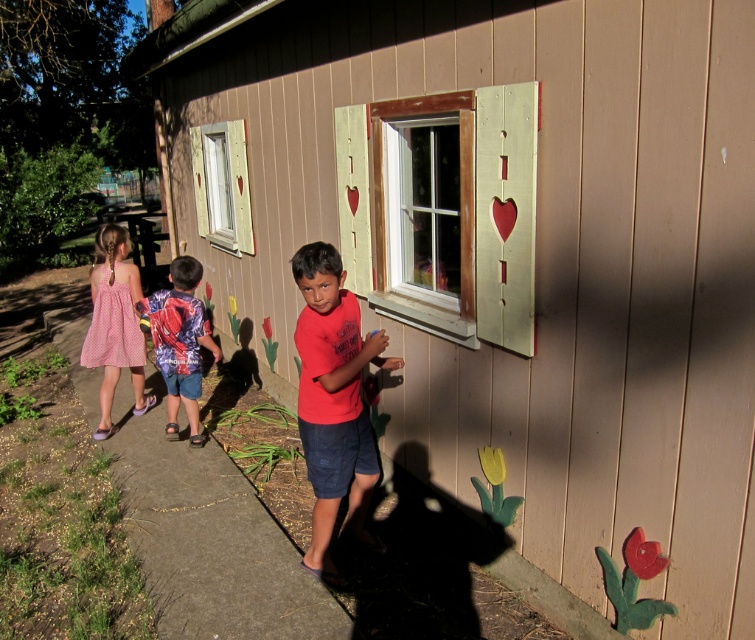
Question: Which object is closer to the camera taking this photo?

Choices:
 (A) brown concrete pavement at lower center
 (B) red matte shirt at center

Answer: (B)

Question: Is white wooden window at center below blue printed shirt at center?

Choices:
 (A) no
 (B) yes

Answer: (A)

Question: Is white wooden window at center wider than blue printed shirt at center?

Choices:
 (A) yes
 (B) no

Answer: (B)

Question: Which point is closer to the camera?

Choices:
 (A) (51, 323)
 (B) (381, 333)

Answer: (B)

Question: Among these objects, which one is nearest to the camera?

Choices:
 (A) blue printed shirt at center
 (B) pink dotted dress at left
 (C) white wooden window at center
 (D) white painted wood window at upper left

Answer: (C)

Question: Does red matte shirt at center have a smaller size compared to pink dotted dress at left?

Choices:
 (A) yes
 (B) no

Answer: (A)